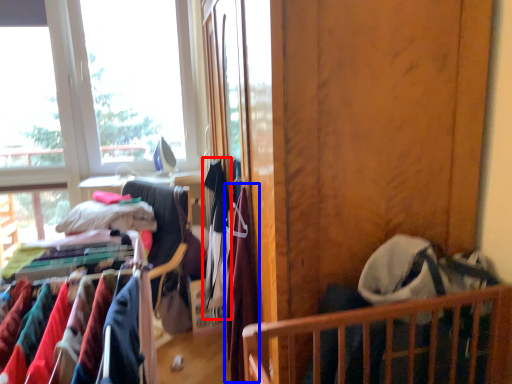
Question: Which point is closer to the camera, clothing (highlighted by a red box) or clothing (highlighted by a blue box)?

Choices:
 (A) clothing
 (B) clothing

Answer: (B)